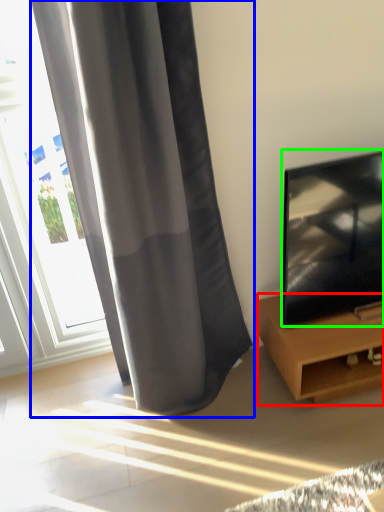
Question: Which is farther away from furniture (highlighted by a red box)? curtain (highlighted by a blue box) or television (highlighted by a green box)?

Choices:
 (A) curtain
 (B) television

Answer: (A)